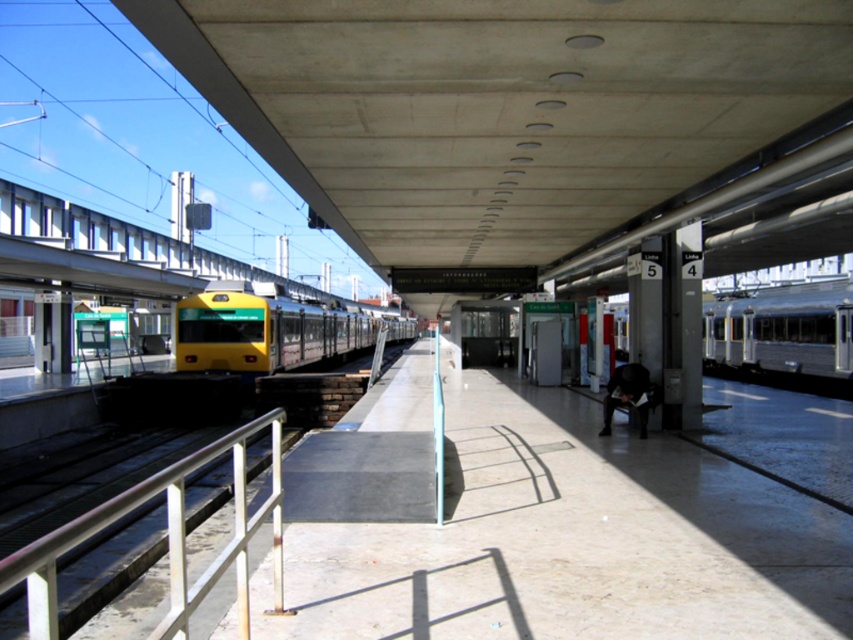
You are standing on the train station platform and want to walk from point (184, 618) to point (257, 308). Which direction should you move to get closer to your destination?

You should move backward because point (184, 618) is closer to the viewer than point (257, 308), so moving backward will take you toward the latter point.

You are standing on the train station platform and notice the white metal rail at lower left and the yellow metallic train at center. Which object is shorter in height?

The white metal rail at lower left is shorter in height compared to the yellow metallic train at center.